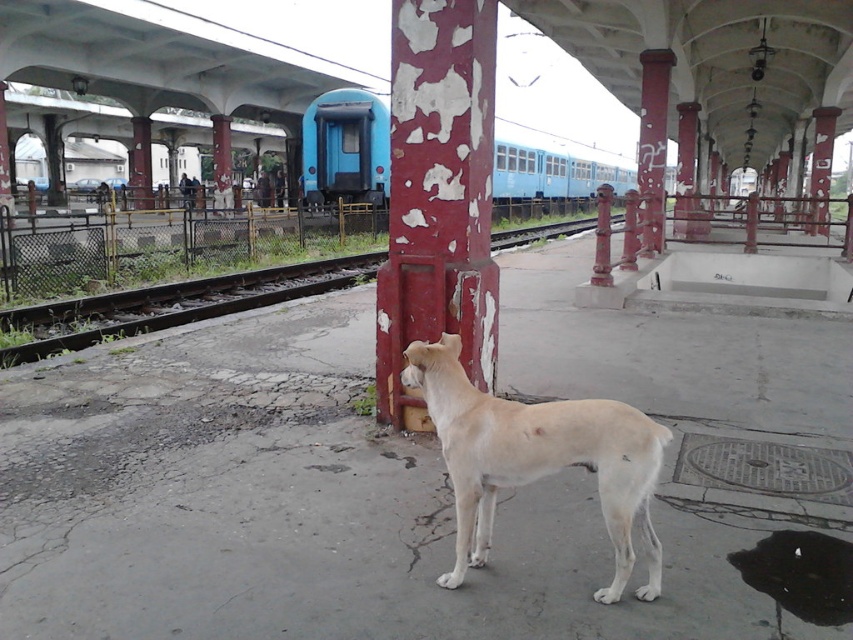
Does fur white dog at center have a lesser width compared to rusty metal pillar at center?

Correct, fur white dog at center's width is less than rusty metal pillar at center's.

How far apart are fur white dog at center and rusty metal pillar at center?

fur white dog at center is 9.12 meters away from rusty metal pillar at center.

Who is more distant from viewer, (479, 417) or (643, 179)?

The point (643, 179) is more distant.

Locate an element on the screen. The image size is (853, 640). fur white dog at center is located at coordinates (537, 458).

Is blue matte train at center thinner than brown gravel train track at lower left?

Incorrect, blue matte train at center's width is not less than brown gravel train track at lower left's.

Is blue matte train at center further to the viewer compared to brown gravel train track at lower left?

No, it is not.

The width and height of the screenshot is (853, 640). What do you see at coordinates (346, 147) in the screenshot? I see `blue matte train at center` at bounding box center [346, 147].

I want to click on blue matte train at center, so click(x=346, y=147).

Which is more to the left, peeling paint column at center or brown gravel train track at lower left?

Positioned to the left is brown gravel train track at lower left.

Is peeling paint column at center to the right of brown gravel train track at lower left from the viewer's perspective?

Indeed, peeling paint column at center is positioned on the right side of brown gravel train track at lower left.

Where is `peeling paint column at center`? The width and height of the screenshot is (853, 640). peeling paint column at center is located at coordinates (438, 195).